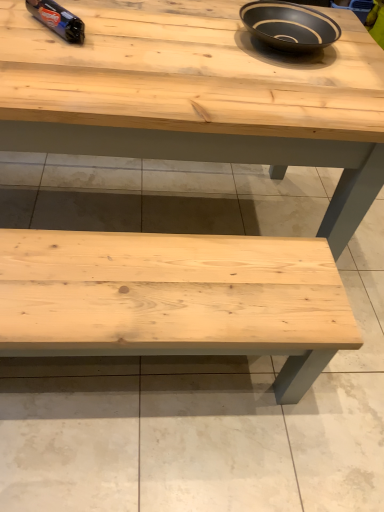
Question: Considering the positions of shiny blue plastic bottle at upper left and natural wood table at center in the image, is shiny blue plastic bottle at upper left bigger or smaller than natural wood table at center?

Choices:
 (A) big
 (B) small

Answer: (B)

Question: Looking at their shapes, would you say shiny blue plastic bottle at upper left is wider or thinner than natural wood table at center?

Choices:
 (A) thin
 (B) wide

Answer: (A)

Question: Estimate the real-world distances between objects in this image. Which object is farther from the black matte bowl at upper center?

Choices:
 (A) natural wood table at center
 (B) shiny blue plastic bottle at upper left
 (C) natural wood bench at bottom

Answer: (C)

Question: Based on their relative distances, which object is farther from the natural wood table at center?

Choices:
 (A) black matte bowl at upper center
 (B) shiny blue plastic bottle at upper left
 (C) natural wood bench at bottom

Answer: (C)